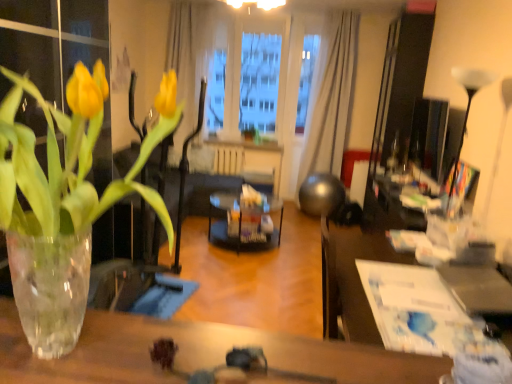
Question: Is white paper at center, arranged as the second table when viewed from the left, not close to white glossy lamp at upper right?

Choices:
 (A) no
 (B) yes

Answer: (B)

Question: Does white paper at center, which is counted as the 1th table, starting from the right, appear on the right side of white glossy lamp at upper right?

Choices:
 (A) yes
 (B) no

Answer: (B)

Question: From the image's perspective, is white paper at center, positioned as the 1th table in back-to-front order, above white glossy lamp at upper right?

Choices:
 (A) no
 (B) yes

Answer: (A)

Question: Is white paper at center, arranged as the second table when viewed from the left, in contact with white glossy lamp at upper right?

Choices:
 (A) yes
 (B) no

Answer: (B)

Question: From a real-world perspective, is white paper at center, arranged as the second table when viewed from the front, physically below white glossy lamp at upper right?

Choices:
 (A) yes
 (B) no

Answer: (A)

Question: Is white glossy lamp at upper right situated inside transparent plastic window screen at center or outside?

Choices:
 (A) inside
 (B) outside

Answer: (B)

Question: Considering their positions, is white glossy lamp at upper right located in front of or behind transparent plastic window screen at center?

Choices:
 (A) behind
 (B) front

Answer: (B)

Question: Is white glossy lamp at upper right wider or thinner than transparent plastic window screen at center?

Choices:
 (A) thin
 (B) wide

Answer: (B)

Question: From the image's perspective, is white glossy lamp at upper right above or below transparent plastic window screen at center?

Choices:
 (A) below
 (B) above

Answer: (A)

Question: Is black glass table at center spatially inside white sheer curtain at upper center, or outside of it?

Choices:
 (A) outside
 (B) inside

Answer: (A)

Question: From a real-world perspective, is black glass table at center above or below white sheer curtain at upper center?

Choices:
 (A) above
 (B) below

Answer: (B)

Question: Visually, is black glass table at center positioned to the left or to the right of white sheer curtain at upper center?

Choices:
 (A) right
 (B) left

Answer: (B)

Question: In terms of size, does black glass table at center appear bigger or smaller than white sheer curtain at upper center?

Choices:
 (A) big
 (B) small

Answer: (B)

Question: Is white sheer curtain at upper center taller or shorter than transparent glass table at lower center, the 1th table when ordered from front to back?

Choices:
 (A) short
 (B) tall

Answer: (B)

Question: Is white sheer curtain at upper center bigger or smaller than transparent glass table at lower center, the 1th table when ordered from front to back?

Choices:
 (A) big
 (B) small

Answer: (A)